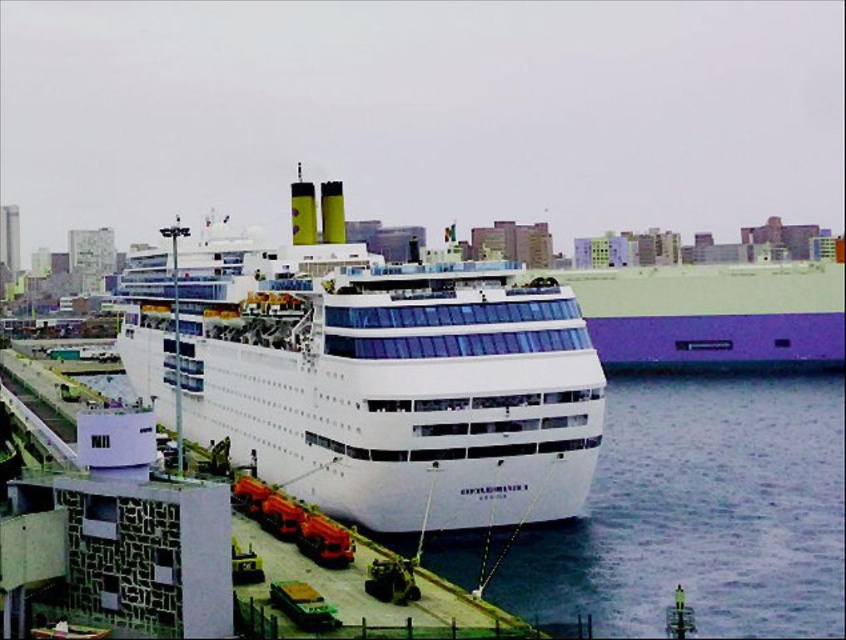
Question: Does white glossy cruise ship at center have a lesser width compared to clear water at lower center?

Choices:
 (A) no
 (B) yes

Answer: (A)

Question: Which of the following is the closest to the observer?

Choices:
 (A) clear water at lower center
 (B) white glossy cruise ship at center

Answer: (A)

Question: Which point is farther to the camera?

Choices:
 (A) (289, 360)
 (B) (509, 572)

Answer: (A)

Question: Which object is farther from the camera taking this photo?

Choices:
 (A) white glossy cruise ship at center
 (B) clear water at lower center

Answer: (A)

Question: Is white glossy cruise ship at center further to camera compared to clear water at lower center?

Choices:
 (A) yes
 (B) no

Answer: (A)

Question: Is white glossy cruise ship at center smaller than clear water at lower center?

Choices:
 (A) yes
 (B) no

Answer: (B)